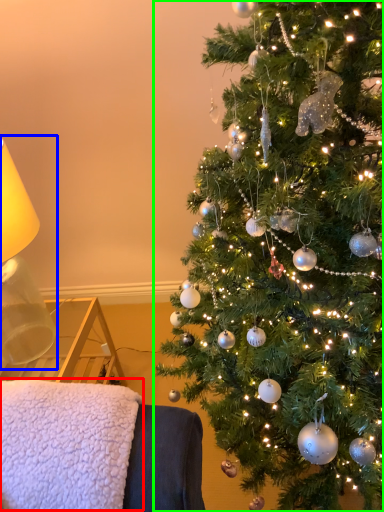
Question: Considering the real-world distances, which object is farthest from blanket (highlighted by a red box)? table lamp (highlighted by a blue box) or christmas tree (highlighted by a green box)?

Choices:
 (A) table lamp
 (B) christmas tree

Answer: (A)